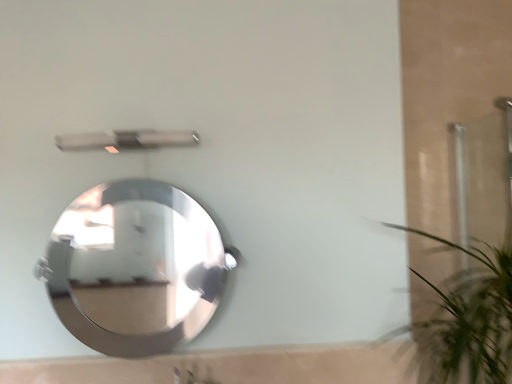
Question: Considering the relative sizes of metallic silver shower at upper center and green leafy plant at right in the image provided, is metallic silver shower at upper center shorter than green leafy plant at right?

Choices:
 (A) no
 (B) yes

Answer: (B)

Question: Does metallic silver shower at upper center contain green leafy plant at right?

Choices:
 (A) no
 (B) yes

Answer: (A)

Question: Is there a large distance between metallic silver shower at upper center and green leafy plant at right?

Choices:
 (A) yes
 (B) no

Answer: (B)

Question: Does metallic silver shower at upper center have a lesser width compared to green leafy plant at right?

Choices:
 (A) yes
 (B) no

Answer: (A)

Question: From the image's perspective, is metallic silver shower at upper center over green leafy plant at right?

Choices:
 (A) yes
 (B) no

Answer: (A)

Question: From the image's perspective, is metallic silver shower at upper center below green leafy plant at right?

Choices:
 (A) yes
 (B) no

Answer: (B)

Question: Is polished silver mirror at center further to camera compared to green leafy plant at right?

Choices:
 (A) yes
 (B) no

Answer: (A)

Question: Is polished silver mirror at center to the right of green leafy plant at right from the viewer's perspective?

Choices:
 (A) yes
 (B) no

Answer: (B)

Question: Can you confirm if polished silver mirror at center is positioned to the left of green leafy plant at right?

Choices:
 (A) yes
 (B) no

Answer: (A)

Question: Is polished silver mirror at center placed right next to green leafy plant at right?

Choices:
 (A) yes
 (B) no

Answer: (B)

Question: Can you confirm if polished silver mirror at center is thinner than green leafy plant at right?

Choices:
 (A) yes
 (B) no

Answer: (A)

Question: Is polished silver mirror at center positioned in front of green leafy plant at right?

Choices:
 (A) no
 (B) yes

Answer: (A)

Question: Is metallic silver shower at upper center positioned behind polished silver mirror at center?

Choices:
 (A) yes
 (B) no

Answer: (A)